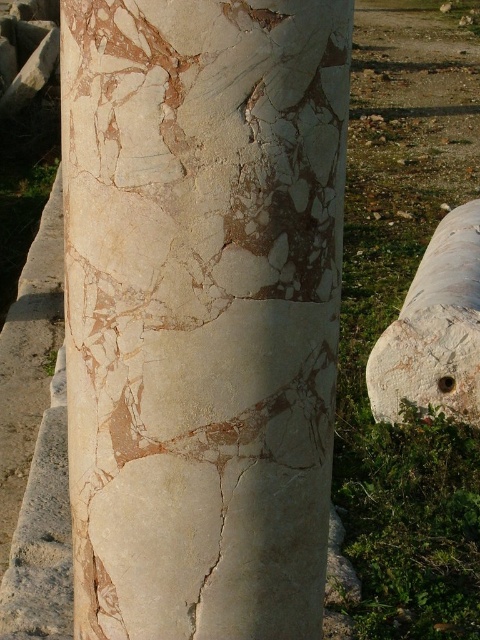
Question: Is marble column at center closer to camera compared to white marble column at center?

Choices:
 (A) yes
 (B) no

Answer: (A)

Question: Which object is farther from the camera taking this photo?

Choices:
 (A) marble column at center
 (B) white marble column at center

Answer: (B)

Question: Can you confirm if marble column at center is thinner than white marble column at center?

Choices:
 (A) yes
 (B) no

Answer: (A)

Question: Is marble column at center smaller than white marble column at center?

Choices:
 (A) no
 (B) yes

Answer: (B)

Question: Which point is closer to the camera taking this photo?

Choices:
 (A) (147, 22)
 (B) (454, 348)

Answer: (A)